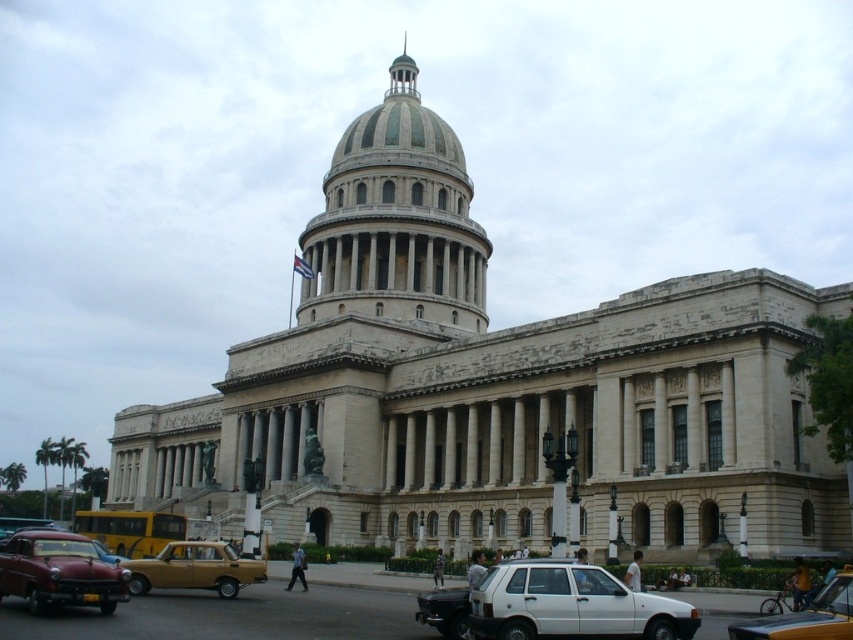
Does shiny red car at lower left lie in front of matte yellow taxi at center?

Yes, it is in front of matte yellow taxi at center.

Can you confirm if shiny red car at lower left is shorter than matte yellow taxi at center?

Yes, shiny red car at lower left is shorter than matte yellow taxi at center.

Which is in front, point (109, 563) or point (219, 566)?

Point (109, 563) is in front.

Find the location of a particular element. This screenshot has width=853, height=640. shiny red car at lower left is located at coordinates (59, 572).

Who is positioned more to the right, white matte car at center or shiny red car at lower left?

white matte car at center

Is white matte car at center smaller than shiny red car at lower left?

Yes, white matte car at center is smaller than shiny red car at lower left.

Does point (554, 600) come farther from viewer compared to point (74, 576)?

No, (554, 600) is closer to viewer.

The image size is (853, 640). I want to click on white matte car at center, so click(572, 605).

This screenshot has width=853, height=640. Describe the element at coordinates (59, 572) in the screenshot. I see `shiny red car at lower left` at that location.

Does point (126, 572) come farther from viewer compared to point (158, 524)?

No.

This screenshot has height=640, width=853. What are the coordinates of `shiny red car at lower left` in the screenshot? It's located at pos(59,572).